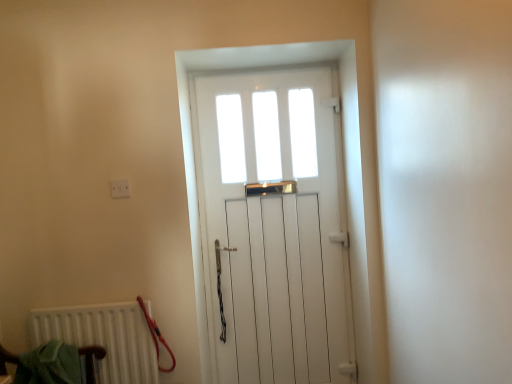
Question: Is white wooden door at center outside of white plastic electric outlet at upper left?

Choices:
 (A) no
 (B) yes

Answer: (B)

Question: Is white wooden door at center aimed at white plastic electric outlet at upper left?

Choices:
 (A) no
 (B) yes

Answer: (A)

Question: Can you confirm if white wooden door at center is shorter than white plastic electric outlet at upper left?

Choices:
 (A) yes
 (B) no

Answer: (B)

Question: From a real-world perspective, is white wooden door at center on white plastic electric outlet at upper left?

Choices:
 (A) yes
 (B) no

Answer: (B)

Question: Would you consider white wooden door at center to be distant from white plastic electric outlet at upper left?

Choices:
 (A) yes
 (B) no

Answer: (B)

Question: Does white wooden door at center appear on the right side of white plastic electric outlet at upper left?

Choices:
 (A) no
 (B) yes

Answer: (B)

Question: From a real-world perspective, is green fabric armchair at lower left physically below white wooden door at center?

Choices:
 (A) no
 (B) yes

Answer: (B)

Question: Does green fabric armchair at lower left come behind white wooden door at center?

Choices:
 (A) no
 (B) yes

Answer: (A)

Question: Is green fabric armchair at lower left shorter than white wooden door at center?

Choices:
 (A) yes
 (B) no

Answer: (A)

Question: Is green fabric armchair at lower left beside white wooden door at center?

Choices:
 (A) yes
 (B) no

Answer: (B)

Question: From a real-world perspective, is green fabric armchair at lower left over white wooden door at center?

Choices:
 (A) no
 (B) yes

Answer: (A)

Question: Does green fabric armchair at lower left have a greater height compared to white wooden door at center?

Choices:
 (A) no
 (B) yes

Answer: (A)

Question: Does green fabric armchair at lower left turn towards white plastic electric outlet at upper left?

Choices:
 (A) yes
 (B) no

Answer: (B)